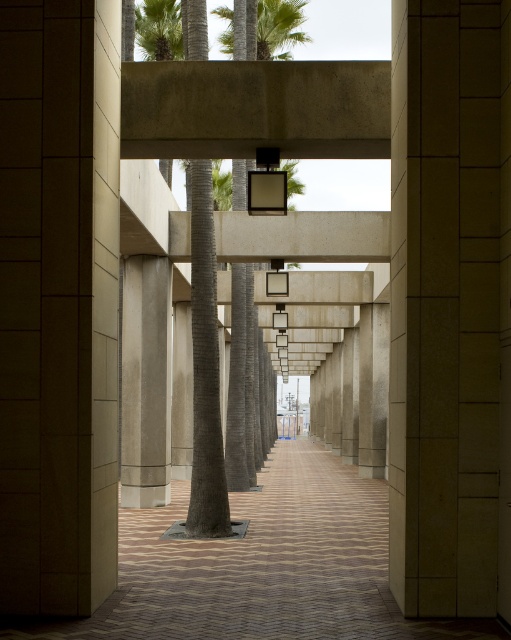
From the picture: Is sanded concrete column at center thinner than green leafy palm tree at upper center?

Indeed, sanded concrete column at center has a lesser width compared to green leafy palm tree at upper center.

Looking at this image, is sanded concrete column at center to the left of green leafy palm tree at upper center from the viewer's perspective?

Correct, you'll find sanded concrete column at center to the left of green leafy palm tree at upper center.

At what (x,y) coordinates should I click in order to perform the action: click on sanded concrete column at center. Please return your answer as a coordinate pair (x, y). Looking at the image, I should click on (146, 381).

Does brown brick path at lower center appear under green leafy palm tree at upper center?

Yes.

Based on the photo, can you confirm if brown brick path at lower center is taller than green leafy palm tree at upper center?

No, brown brick path at lower center is not taller than green leafy palm tree at upper center.

Between point (323, 570) and point (283, 42), which one is positioned in front?

Point (323, 570) is more forward.

Find the location of a particular element. This screenshot has width=511, height=640. brown brick path at lower center is located at coordinates (262, 566).

Which of these two, brown brick path at lower center or sanded concrete column at center, stands taller?

sanded concrete column at center is taller.

What do you see at coordinates (262, 566) in the screenshot? I see `brown brick path at lower center` at bounding box center [262, 566].

This screenshot has height=640, width=511. In order to click on brown brick path at lower center in this screenshot , I will do `click(262, 566)`.